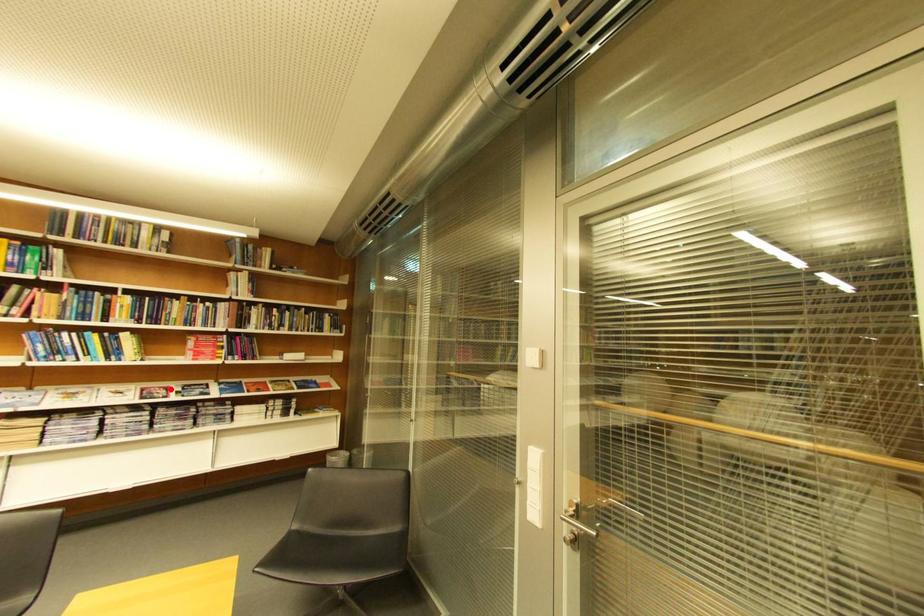
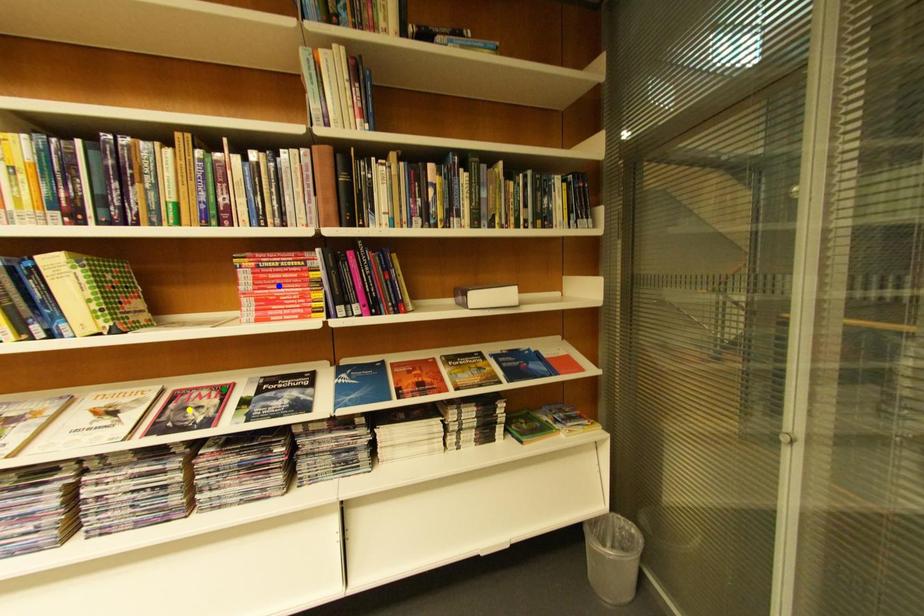
Question: I am providing you with two images of the same scene from different viewpoints. A red point is marked on the first image. You are given multiple points on the second image. Which spot in image 2 lines up with the point in image 1?

Choices:
 (A) blue point
 (B) yellow point
 (C) green point

Answer: (C)